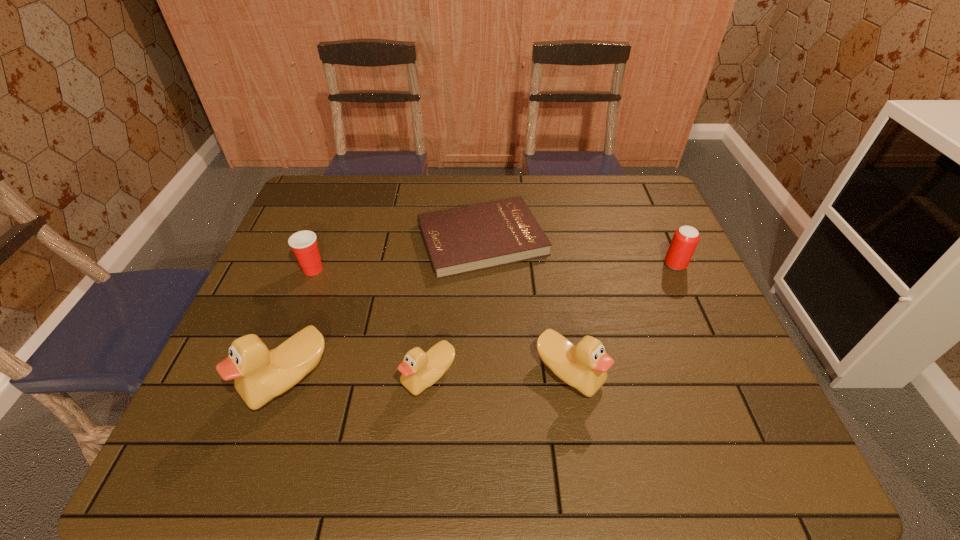
Find the location of a particular element. This screenshot has height=540, width=960. object at the near left corner is located at coordinates (260, 375).

I want to click on free location at the far edge, so click(379, 184).

Image resolution: width=960 pixels, height=540 pixels. I want to click on free point at the near edge, so click(631, 386).

Locate an element on the screen. vacant area at the left edge of the desktop is located at coordinates (278, 268).

The height and width of the screenshot is (540, 960). In order to click on vacant space at the right edge in this screenshot , I will do `click(725, 373)`.

The height and width of the screenshot is (540, 960). In order to click on blank space at the far right corner of the desktop in this screenshot , I will do `click(615, 212)`.

At what (x,y) coordinates should I click in order to perform the action: click on empty space that is in between the shortest object and the Dixie cup. Please return your answer as a coordinate pair (x, y). The width and height of the screenshot is (960, 540). Looking at the image, I should click on (397, 254).

Identify the location of vacant area between the rightmost duck and the hardback book. Image resolution: width=960 pixels, height=540 pixels. (525, 306).

The image size is (960, 540). In order to click on free space between the hardback book and the Dixie cup in this screenshot , I will do `click(397, 254)`.

Locate an element on the screen. vacant area between the shortest object and the second tallest duck is located at coordinates (525, 306).